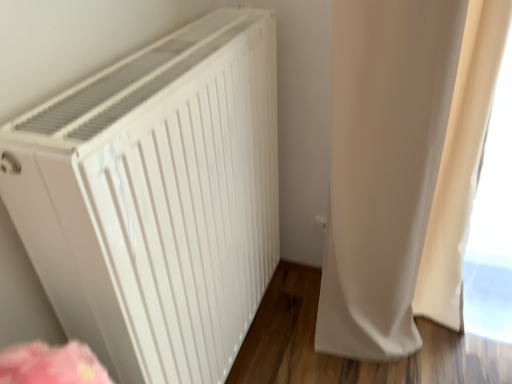
Question: Is white matte radiator at left in front of or behind beige fabric curtain at right in the image?

Choices:
 (A) behind
 (B) front

Answer: (B)

Question: Do you think white matte radiator at left is within beige fabric curtain at right, or outside of it?

Choices:
 (A) inside
 (B) outside

Answer: (B)

Question: Is white matte radiator at left wider or thinner than beige fabric curtain at right?

Choices:
 (A) wide
 (B) thin

Answer: (B)

Question: Considering the positions of point (359, 132) and point (264, 130), is point (359, 132) closer or farther from the camera than point (264, 130)?

Choices:
 (A) farther
 (B) closer

Answer: (B)

Question: From a real-world perspective, relative to white matte radiator at left, is beige fabric curtain at right vertically above or below?

Choices:
 (A) above
 (B) below

Answer: (B)

Question: From the image's perspective, relative to white matte radiator at left, is beige fabric curtain at right above or below?

Choices:
 (A) below
 (B) above

Answer: (B)

Question: Relative to white matte radiator at left, is beige fabric curtain at right in front or behind?

Choices:
 (A) behind
 (B) front

Answer: (A)